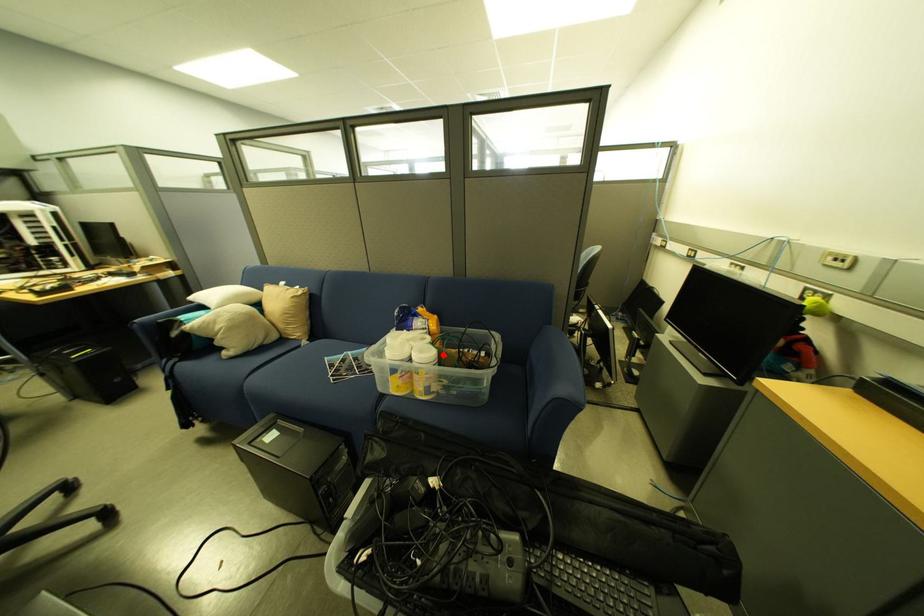
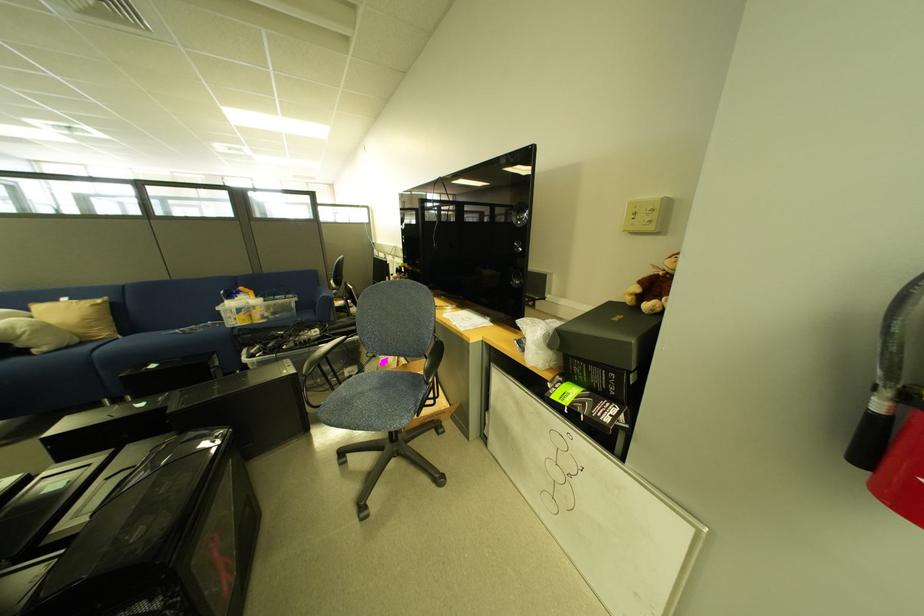
The point at the highlighted location is marked in the first image. Where is the corresponding point in the second image?

(272, 302)